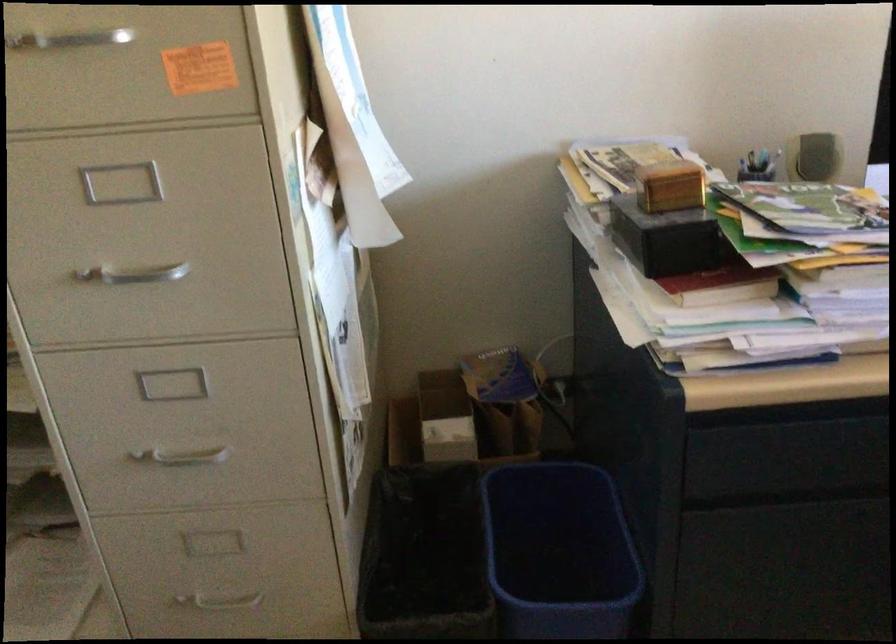
Identify the location of black trash bin. (425, 556).